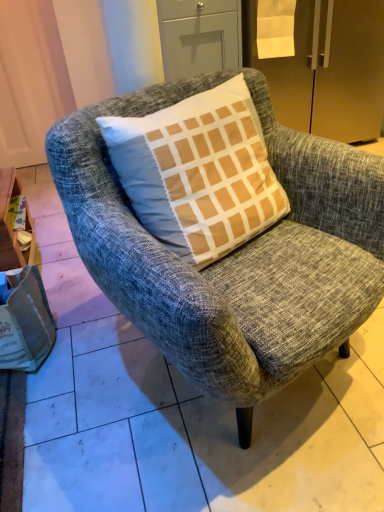
Locate an element on the screen. This screenshot has width=384, height=512. vacant area that is situated to the right of wooden at left is located at coordinates (73, 278).